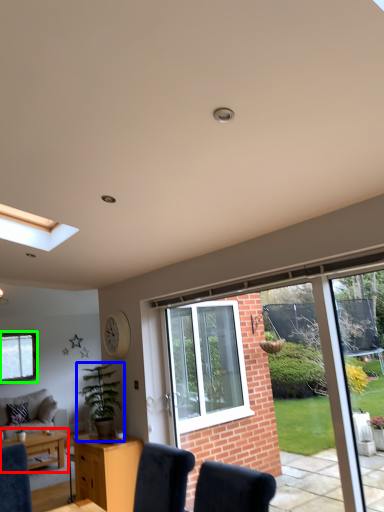
Question: Estimate the real-world distances between objects in this image. Which object is farther from table (highlighted by a red box), houseplant (highlighted by a blue box) or window (highlighted by a green box)?

Choices:
 (A) houseplant
 (B) window

Answer: (B)